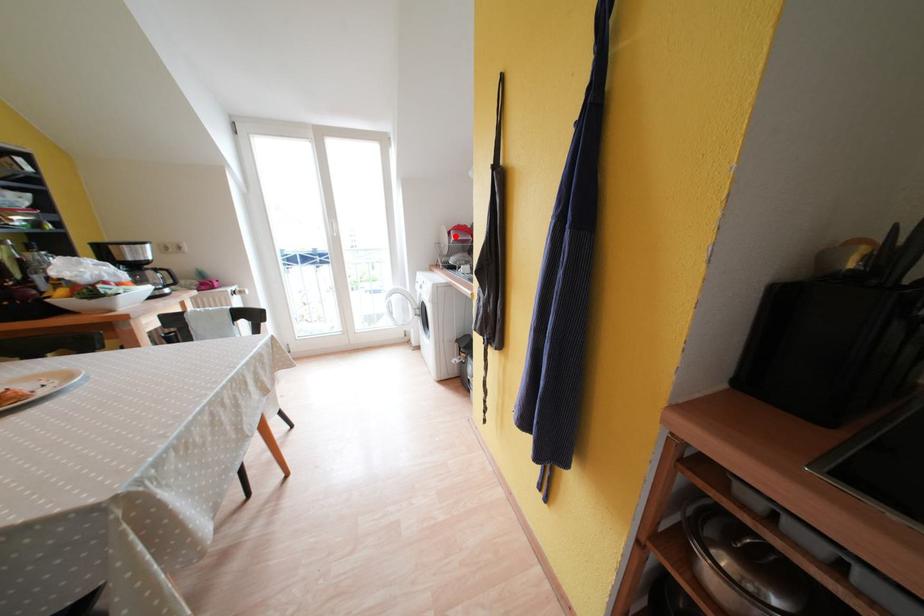
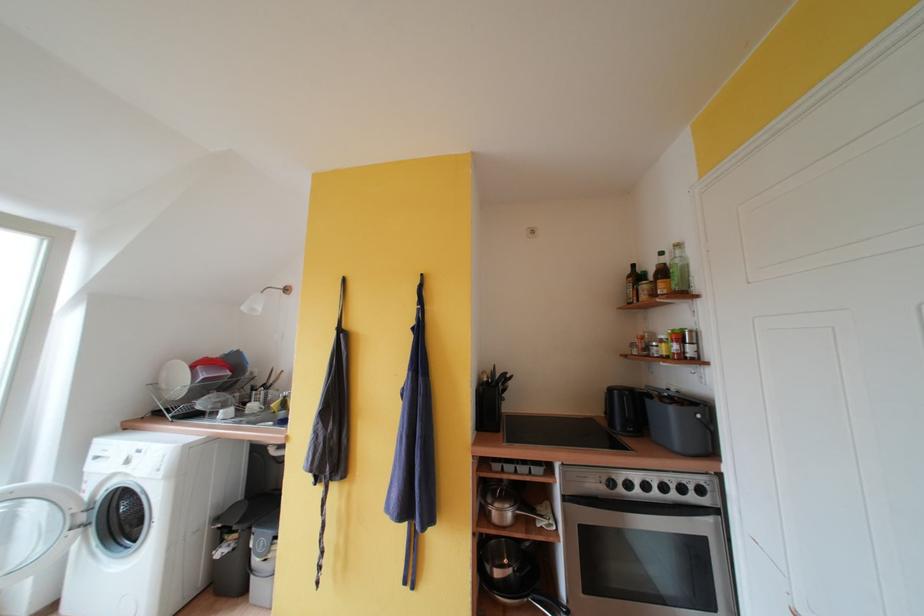
The point at the highlighted location is marked in the first image. Where is the corresponding point in the second image?

(199, 371)